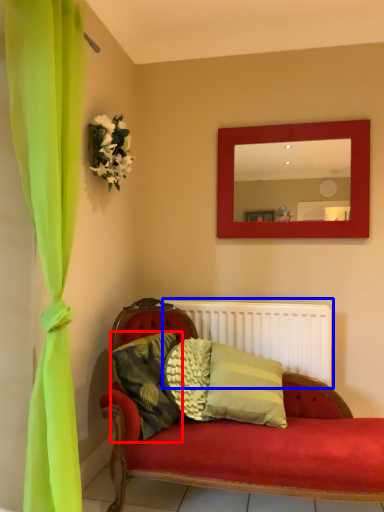
Question: Which point is closer to the camera, pillow (highlighted by a red box) or radiator (highlighted by a blue box)?

Choices:
 (A) pillow
 (B) radiator

Answer: (A)